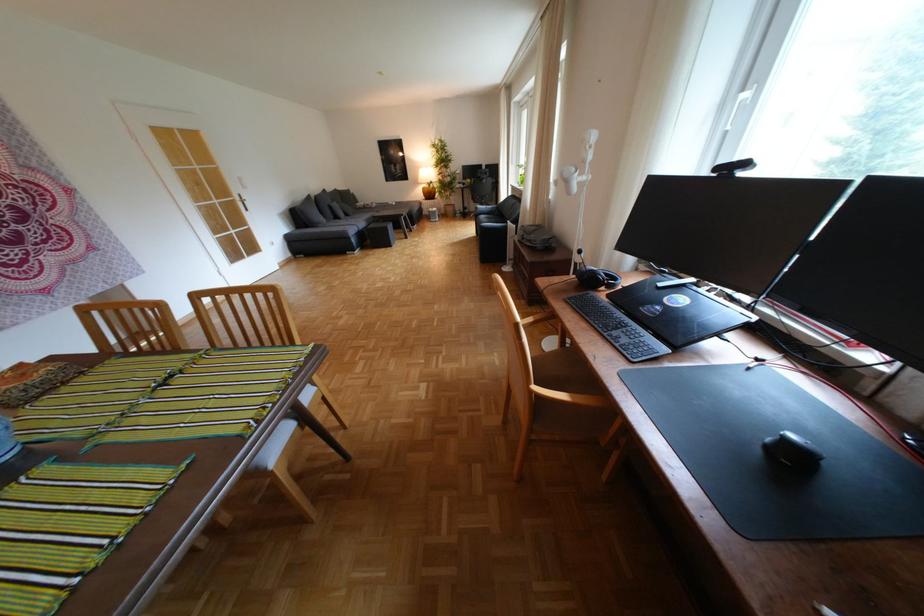
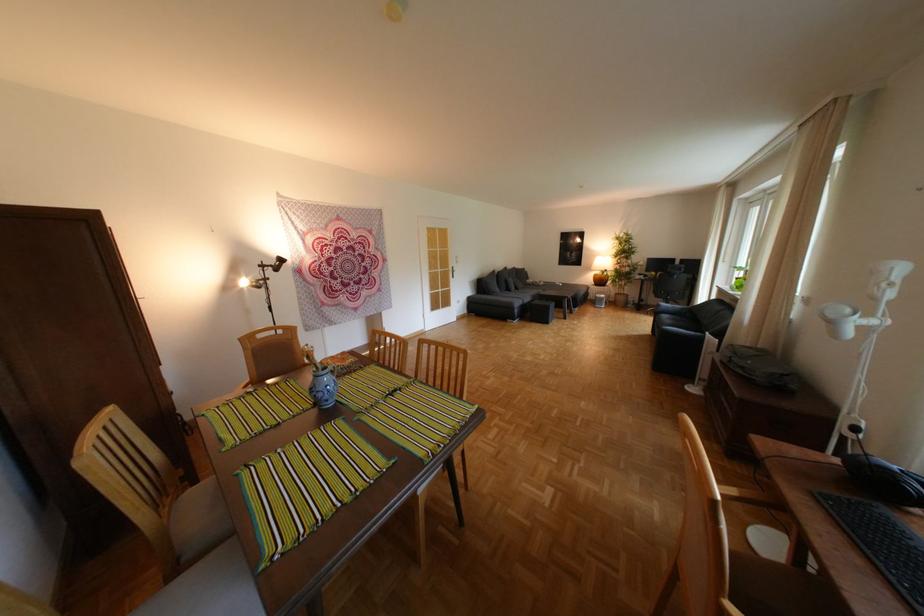
The point at (x=548, y=387) is marked in the first image. Where is the corresponding point in the second image?

(744, 608)